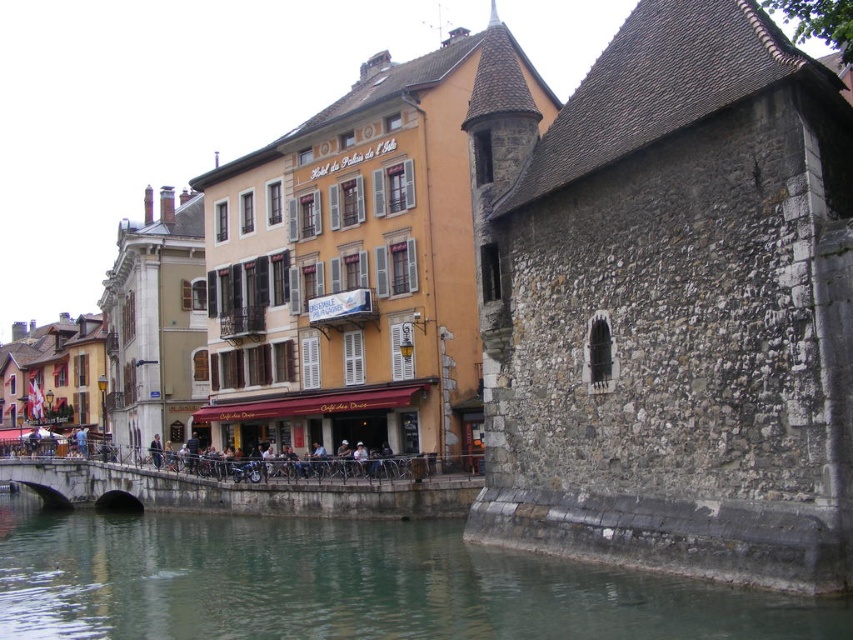
Question: Is greenish stone water at lower left thinner than concrete stone bridge at lower center?

Choices:
 (A) no
 (B) yes

Answer: (A)

Question: Does greenish stone water at lower left have a larger size compared to concrete stone bridge at lower center?

Choices:
 (A) yes
 (B) no

Answer: (A)

Question: In this image, where is greenish stone water at lower left located relative to concrete stone bridge at lower center?

Choices:
 (A) right
 (B) left

Answer: (B)